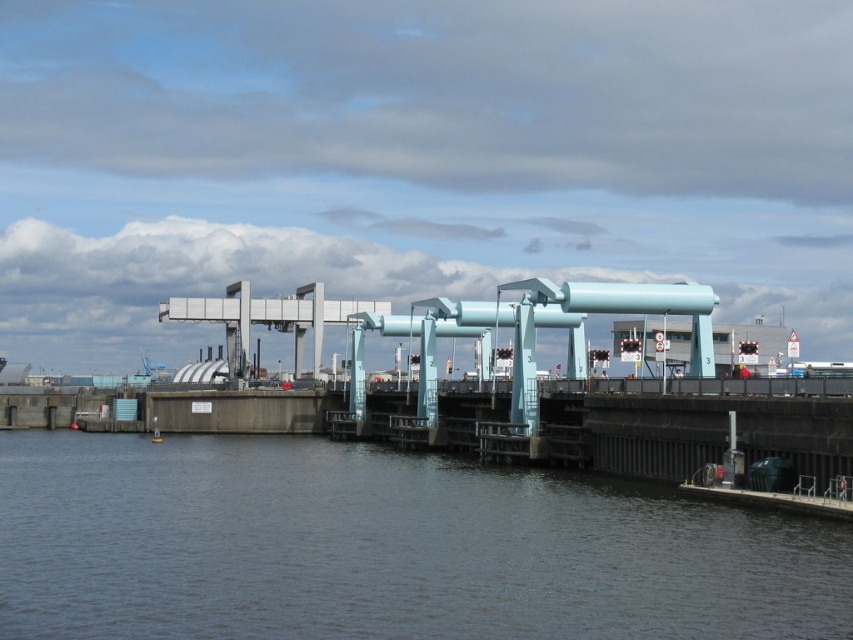
Between dark gray water at lower center and metallic silver boat at center, which one appears on the right side from the viewer's perspective?

dark gray water at lower center is more to the right.

Between point (140, 614) and point (160, 436), which one is positioned in front?

Positioned in front is point (140, 614).

Which is in front, point (209, 474) or point (155, 422)?

Positioned in front is point (209, 474).

Find the location of a particular element. The height and width of the screenshot is (640, 853). dark gray water at lower center is located at coordinates (386, 547).